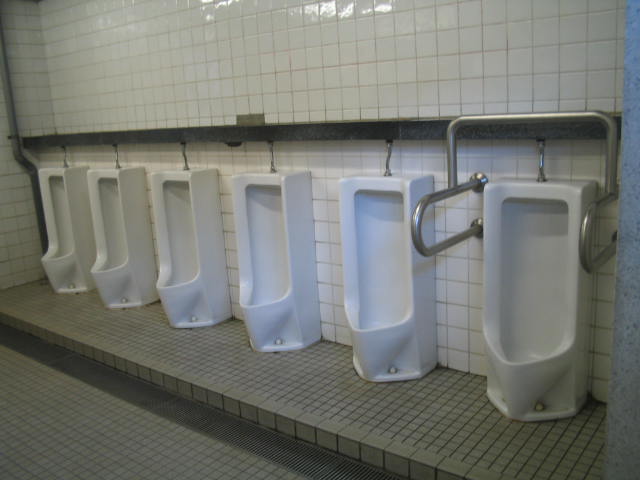
Locate an element on the screen. shelving above urinals is located at coordinates (575, 109), (420, 124), (354, 136), (272, 121), (320, 124), (180, 131), (214, 125), (134, 132), (77, 135), (35, 135).